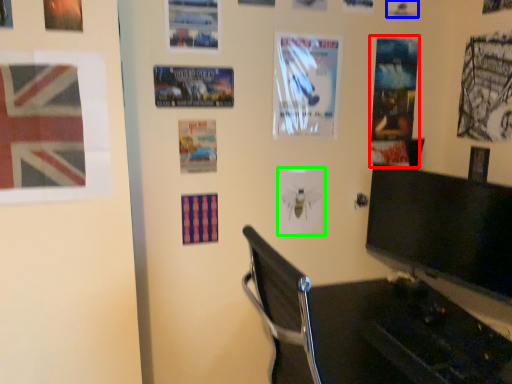
Question: Which is farther away from poster page (highlighted by a red box)? poster page (highlighted by a blue box) or poster (highlighted by a green box)?

Choices:
 (A) poster page
 (B) poster

Answer: (B)